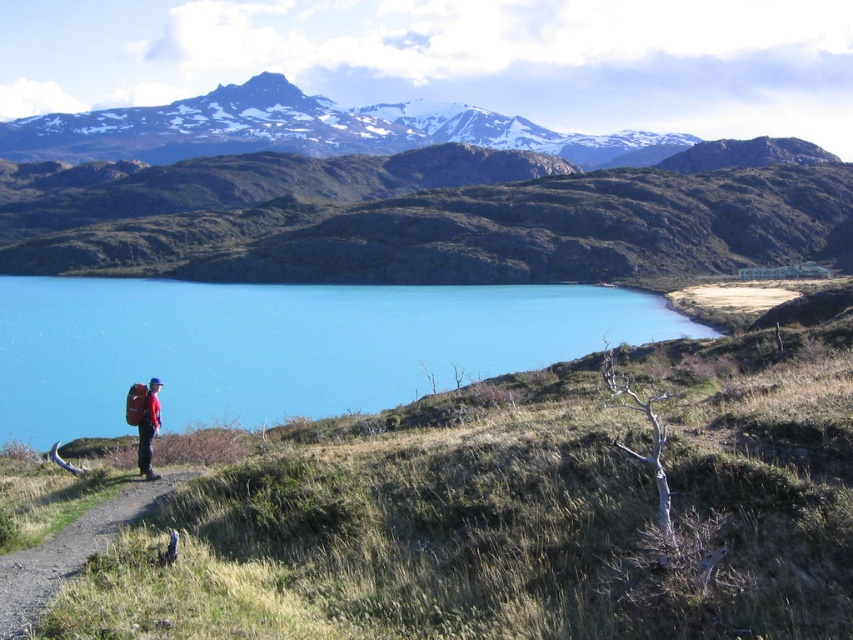
You are a hiker planning to walk along the dirt path at lower left while carrying the matte red backpack at lower left. Given the path is narrow, will the backpack fit comfortably without getting stuck?

The dirt path at lower left is narrower than the matte red backpack at lower left, so the backpack may get stuck or not fit comfortably on the path.

You are a hiker trying to navigate the terrain in the image. You see two points marked on the map as point 1 at coordinates point (326, 362) and point 2 at coordinates point (148, 435). Which point is closer to your current position?

Point 1 at coordinates point (326, 362) is closer to your current position because it is further to the viewer than point 2 at coordinates point (148, 435).

Consider the image. You are a hiker standing at the starting point of the dirt path at lower left and want to place your matte red backpack at lower left on the ground. Can you tell me if the backpack will be visible from the path?

The dirt path at lower left is not as tall as matte red backpack at lower left, so the backpack will be visible from the path.